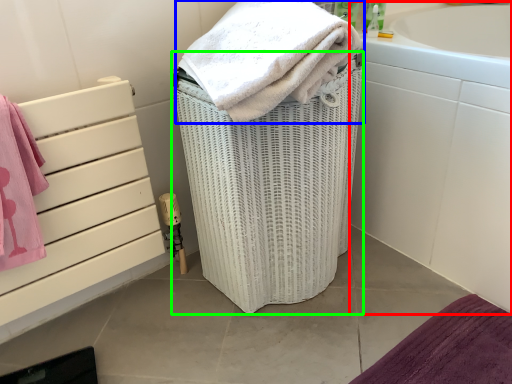
Question: Which object is positioned farthest from bath (highlighted by a red box)? Select from towel (highlighted by a blue box) and basket container (highlighted by a green box).

Choices:
 (A) towel
 (B) basket container

Answer: (A)